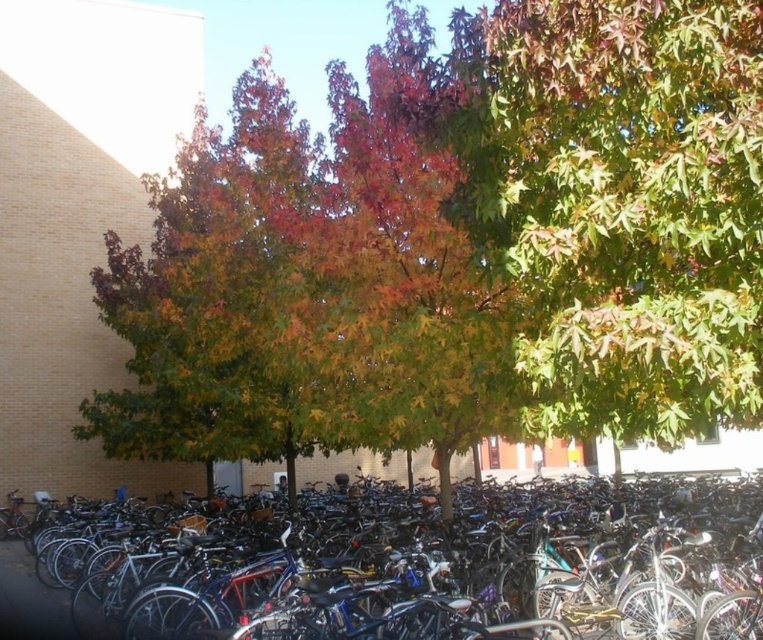
Question: Which point is closer to the camera?

Choices:
 (A) (720, 504)
 (B) (675, 172)
 (C) (496, 157)

Answer: (B)

Question: Which of the following is the closest to the observer?

Choices:
 (A) (716, 145)
 (B) (485, 540)

Answer: (A)

Question: Can you confirm if green matte tree at center is wider than shiny metallic bicycle at center?

Choices:
 (A) yes
 (B) no

Answer: (B)

Question: Which point is farther to the camera?

Choices:
 (A) multicolored foliage at center
 (B) green matte tree at center
 (C) shiny metallic bicycle at center

Answer: (B)

Question: Observing the image, what is the correct spatial positioning of green matte tree at center in reference to shiny metallic bicycle at center?

Choices:
 (A) left
 (B) right

Answer: (B)

Question: Is multicolored foliage at center to the right of shiny metallic bicycle at center from the viewer's perspective?

Choices:
 (A) yes
 (B) no

Answer: (B)